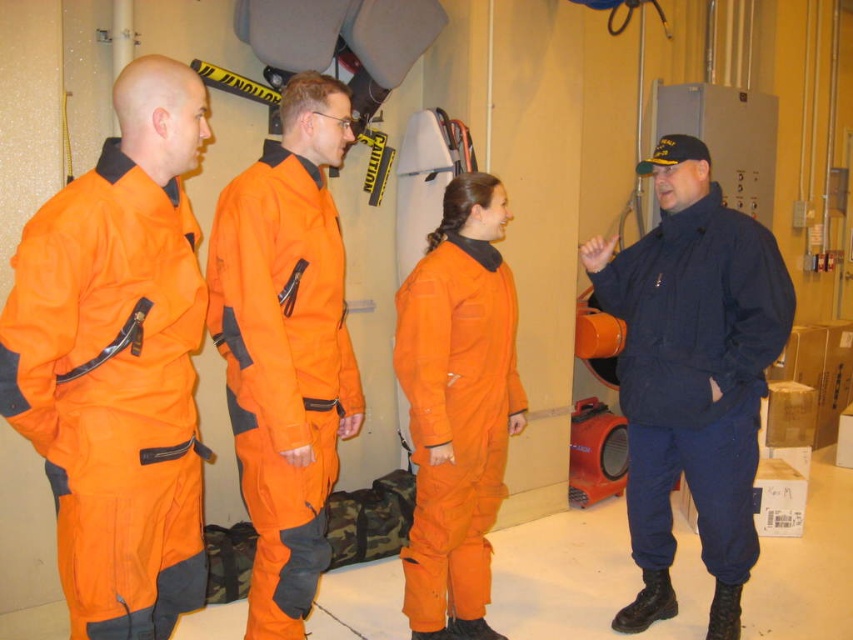
Between orange matte jumpsuit at left and navy blue uniform at right, which one is positioned higher?

orange matte jumpsuit at left is above.

Between orange matte jumpsuit at left and navy blue uniform at right, which one has more height?

Standing taller between the two is navy blue uniform at right.

Where is `orange matte jumpsuit at left`? The height and width of the screenshot is (640, 853). orange matte jumpsuit at left is located at coordinates (119, 362).

Between orange matte jumpsuit at left and orange fabric jumpsuit at center, which one has more height?

orange fabric jumpsuit at center

Between orange matte jumpsuit at left and orange fabric jumpsuit at center, which one has less height?

orange matte jumpsuit at left

Between point (183, 480) and point (247, 172), which one is positioned in front?

Point (183, 480) is more forward.

Image resolution: width=853 pixels, height=640 pixels. Identify the location of orange matte jumpsuit at left. (119, 362).

Does orange matte jumpsuit at left appear on the left side of orange matte jumpsuit at center?

Yes, orange matte jumpsuit at left is to the left of orange matte jumpsuit at center.

Is orange matte jumpsuit at left positioned behind orange matte jumpsuit at center?

No, orange matte jumpsuit at left is closer to the viewer.

This screenshot has height=640, width=853. What do you see at coordinates (119, 362) in the screenshot?
I see `orange matte jumpsuit at left` at bounding box center [119, 362].

This screenshot has height=640, width=853. Find the location of `orange matte jumpsuit at left`. orange matte jumpsuit at left is located at coordinates (119, 362).